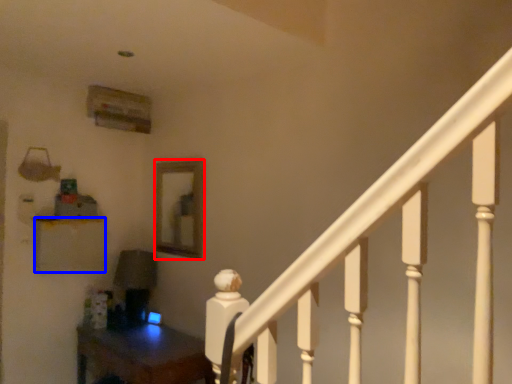
Question: Which point is further to the camera, mirror (highlighted by a red box) or furniture (highlighted by a blue box)?

Choices:
 (A) mirror
 (B) furniture

Answer: (A)